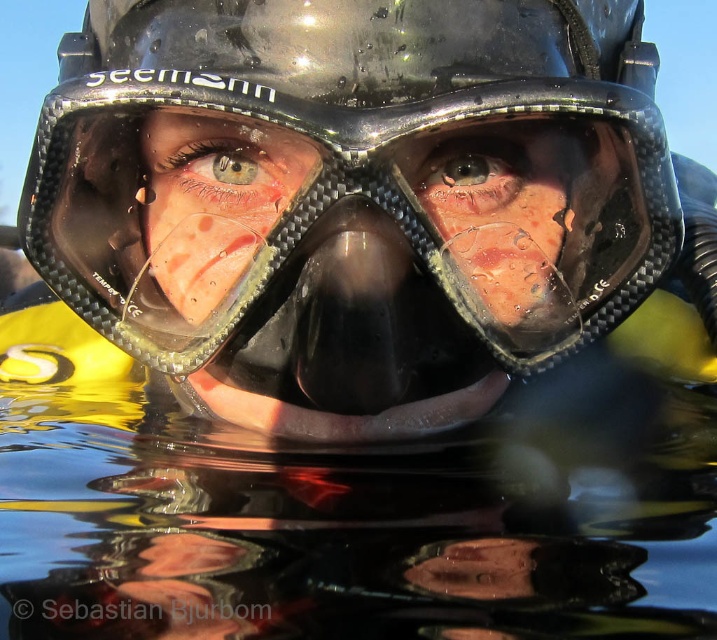
You are a marine biologist observing the diver. You need to determine the relative height of the black matte helmet at center and the blue glossy eye at center. Based on the scene, which object is taller?

The black matte helmet at center is much taller than the blue glossy eye at center.

In the scene shown: You are a photographer trying to capture the diver in the image. You want to focus on the point that is closer to the camera. Which point should you choose between point (526, 102) and point (171, 161)?

Point (526, 102) is closer to the camera than point (171, 161), so you should choose point (526, 102) to focus on.

You are a marine biologist examining the image of a diver. The coordinates provided are in a normalized format where the top left corner is the origin. Based on the coordinates given for the black matte helmet at center, can you determine its position relative to the center of the image?

The black matte helmet at center is located at coordinates approximately 0.298 on the x axis and 0.494 on the y axis. Since the center of the image would be at coordinates approximately 0.5 on both axes, the helmet is positioned to the left of the center horizontally and very close to the center vertically.